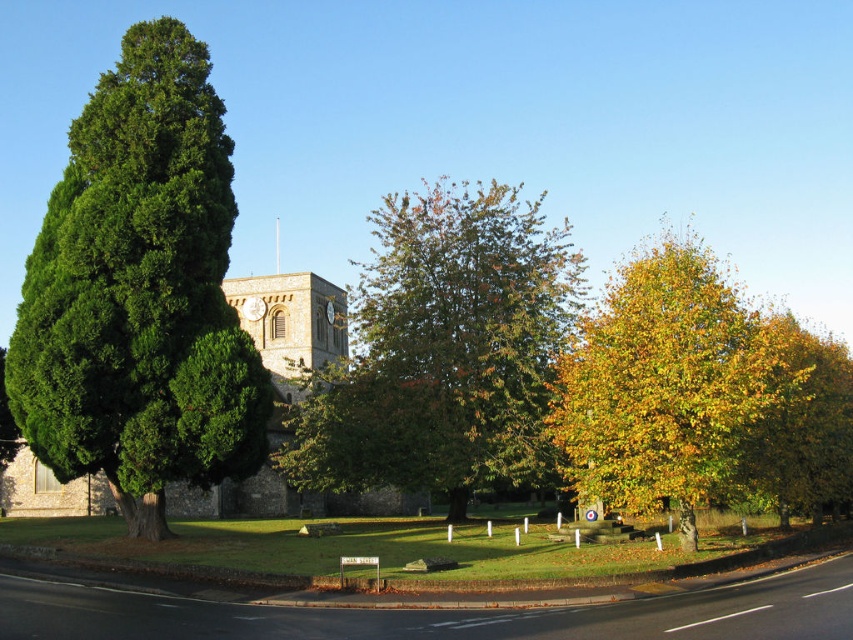
You are a gardener planning to plant a new tree in the area between the green leafy tree at left and the green leafy tree at center. Considering their current sizes, which tree would require more space to the east to accommodate its growth?

The green leafy tree at center would require more space to the east because it has a greater width than the green leafy tree at left.